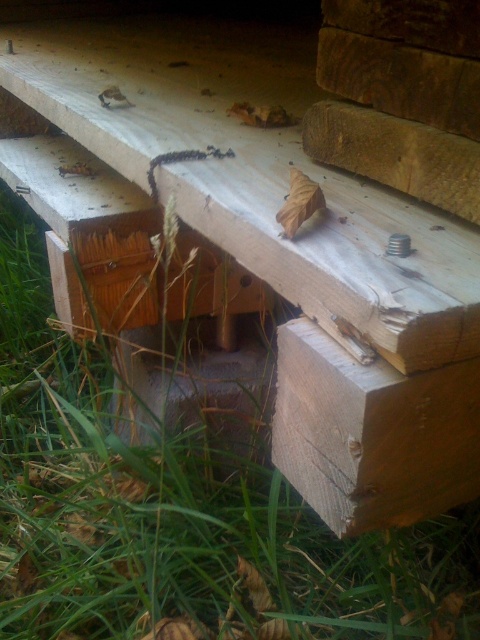
Between green grass at lower left and natural wood plank at lower right, which one appears on the left side from the viewer's perspective?

green grass at lower left is more to the left.

Between point (173, 502) and point (326, 372), which one is positioned in front?

Point (326, 372) is more forward.

What do you see at coordinates (173, 508) in the screenshot? I see `green grass at lower left` at bounding box center [173, 508].

I want to click on green grass at lower left, so click(x=173, y=508).

Who is taller, natural wood at center or natural wood plank at lower right?

natural wood at center

Between point (308, 49) and point (317, 406), which one is positioned in front?

Positioned in front is point (317, 406).

Does point (164, 106) lie behind point (352, 484)?

That is True.

Where is `natural wood at center`? The image size is (480, 640). natural wood at center is located at coordinates (261, 180).

Does green grass at lower left appear on the left side of natural wood at center?

Correct, you'll find green grass at lower left to the left of natural wood at center.

Which is above, green grass at lower left or natural wood at center?

natural wood at center is above.

The image size is (480, 640). Identify the location of green grass at lower left. (173, 508).